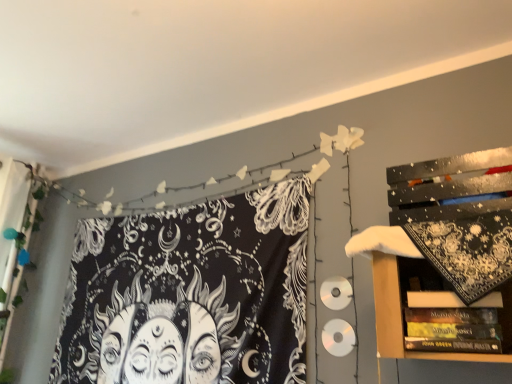
Question: From the image's perspective, is black printed fabric at upper left on top of hardcover books at lower right?

Choices:
 (A) yes
 (B) no

Answer: (B)

Question: Is black printed fabric at upper left in front of hardcover books at lower right?

Choices:
 (A) no
 (B) yes

Answer: (A)

Question: Is black printed fabric at upper left looking in the opposite direction of hardcover books at lower right?

Choices:
 (A) yes
 (B) no

Answer: (B)

Question: Could you tell me if black printed fabric at upper left is turned towards hardcover books at lower right?

Choices:
 (A) yes
 (B) no

Answer: (B)

Question: Is there a large distance between black printed fabric at upper left and hardcover books at lower right?

Choices:
 (A) no
 (B) yes

Answer: (B)

Question: Considering the relative sizes of black printed fabric at upper left and hardcover books at lower right in the image provided, is black printed fabric at upper left wider than hardcover books at lower right?

Choices:
 (A) no
 (B) yes

Answer: (A)

Question: Does hardcover books at lower right have a smaller size compared to black printed fabric at upper left?

Choices:
 (A) no
 (B) yes

Answer: (B)

Question: Does hardcover books at lower right have a lesser width compared to black printed fabric at upper left?

Choices:
 (A) yes
 (B) no

Answer: (B)

Question: Can you confirm if hardcover books at lower right is wider than black printed fabric at upper left?

Choices:
 (A) yes
 (B) no

Answer: (A)

Question: Is black printed fabric at upper left a part of hardcover books at lower right?

Choices:
 (A) yes
 (B) no

Answer: (B)

Question: Is hardcover books at lower right far away from black printed fabric at upper left?

Choices:
 (A) no
 (B) yes

Answer: (B)

Question: From the image's perspective, is hardcover books at lower right over black printed fabric at upper left?

Choices:
 (A) yes
 (B) no

Answer: (A)

Question: Is hardcover books at lower right in front of or behind black printed fabric at upper left in the image?

Choices:
 (A) behind
 (B) front

Answer: (B)